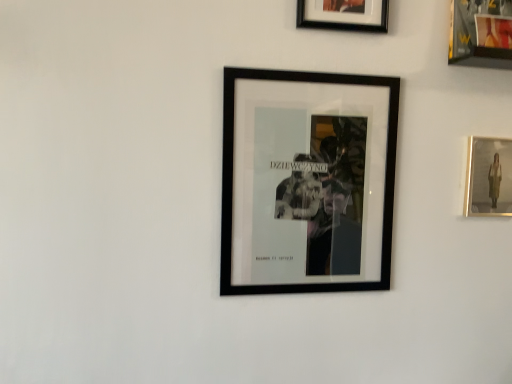
Question: Does metallic gold picture frame at upper right, which appears as the 2th picture frame when viewed from the right, appear on the right side of black matte picture frame at upper center, which ranks as the 2th picture frame in left-to-right order?

Choices:
 (A) no
 (B) yes

Answer: (B)

Question: Considering the relative positions of metallic gold picture frame at upper right, which appears as the 2th picture frame when viewed from the right, and black matte picture frame at upper center, which ranks as the 2th picture frame in left-to-right order, in the image provided, is metallic gold picture frame at upper right, which appears as the 2th picture frame when viewed from the right, to the left of black matte picture frame at upper center, which ranks as the 2th picture frame in left-to-right order, from the viewer's perspective?

Choices:
 (A) no
 (B) yes

Answer: (A)

Question: Is metallic gold picture frame at upper right, which appears as the 2th picture frame when viewed from the right, facing away from black matte picture frame at upper center, which appears as the 3th picture frame when viewed from the right?

Choices:
 (A) no
 (B) yes

Answer: (A)

Question: From a real-world perspective, is metallic gold picture frame at upper right, which is the third picture frame in left-to-right order, positioned over black matte picture frame at upper center, which ranks as the 2th picture frame in left-to-right order, based on gravity?

Choices:
 (A) yes
 (B) no

Answer: (A)

Question: From the image's perspective, is metallic gold picture frame at upper right, which is the third picture frame in left-to-right order, on top of black matte picture frame at upper center, which ranks as the 2th picture frame in left-to-right order?

Choices:
 (A) no
 (B) yes

Answer: (B)

Question: Does point (495, 66) appear closer or farther from the camera than point (347, 249)?

Choices:
 (A) farther
 (B) closer

Answer: (A)

Question: In the image, is metallic gold picture frame at upper right, which is the third picture frame in left-to-right order, positioned in front of or behind black matte picture frame at center, which appears as the 4th picture frame when viewed from the right?

Choices:
 (A) front
 (B) behind

Answer: (B)

Question: In the image, is metallic gold picture frame at upper right, which is the third picture frame in left-to-right order, on the left side or the right side of black matte picture frame at center, which appears as the 4th picture frame when viewed from the right?

Choices:
 (A) right
 (B) left

Answer: (A)

Question: Is metallic gold picture frame at upper right, which is the third picture frame in left-to-right order, situated inside black matte picture frame at center, which appears as the 4th picture frame when viewed from the right, or outside?

Choices:
 (A) inside
 (B) outside

Answer: (B)

Question: From a real-world perspective, relative to matte gold picture frame at right, positioned as the fourth picture frame in left-to-right order, is black matte picture frame at center, which appears as the 4th picture frame when viewed from the right, vertically above or below?

Choices:
 (A) above
 (B) below

Answer: (B)

Question: From the image's perspective, relative to matte gold picture frame at right, positioned as the fourth picture frame in left-to-right order, is black matte picture frame at center, which appears as the first picture frame when viewed from the left, above or below?

Choices:
 (A) above
 (B) below

Answer: (B)

Question: In the image, is black matte picture frame at center, which appears as the first picture frame when viewed from the left, on the left side or the right side of matte gold picture frame at right, positioned as the 1th picture frame in right-to-left order?

Choices:
 (A) right
 (B) left

Answer: (B)

Question: In terms of height, does black matte picture frame at center, which appears as the first picture frame when viewed from the left, look taller or shorter compared to matte gold picture frame at right, positioned as the fourth picture frame in left-to-right order?

Choices:
 (A) tall
 (B) short

Answer: (A)

Question: Looking at their shapes, would you say black matte picture frame at upper center, which appears as the 3th picture frame when viewed from the right, is wider or thinner than matte gold picture frame at right, positioned as the 1th picture frame in right-to-left order?

Choices:
 (A) wide
 (B) thin

Answer: (A)

Question: Does point (326, 8) appear closer or farther from the camera than point (476, 155)?

Choices:
 (A) farther
 (B) closer

Answer: (B)